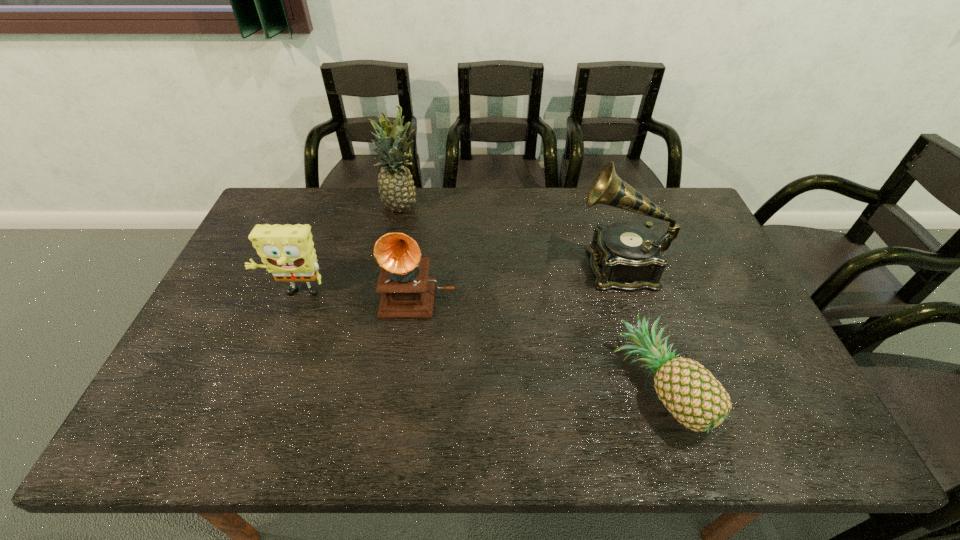
The image size is (960, 540). I want to click on the farthest object, so click(x=396, y=188).

You are a GUI agent. You are given a task and a screenshot of the screen. Output one action in this format:
    pyautogui.click(x=<x>, y=<y>)
    Task: Click on the left pineapple
    
    Given the screenshot: What is the action you would take?
    pyautogui.click(x=396, y=188)

Where is `the taller phonograph record`? the taller phonograph record is located at coordinates (628, 256).

Image resolution: width=960 pixels, height=540 pixels. Identify the location of the left phonograph record. (408, 292).

The image size is (960, 540). In order to click on the leftmost object in this screenshot , I will do `click(287, 251)`.

Identify the location of the nearest object. This screenshot has height=540, width=960. (689, 391).

I want to click on the right pineapple, so click(689, 391).

Locate an element on the screen. free spot located on the left of the farther pineapple is located at coordinates (276, 207).

Where is `free space located on the horn of the right phonograph record`? free space located on the horn of the right phonograph record is located at coordinates (503, 266).

The height and width of the screenshot is (540, 960). I want to click on vacant space located on the horn of the right phonograph record, so click(560, 266).